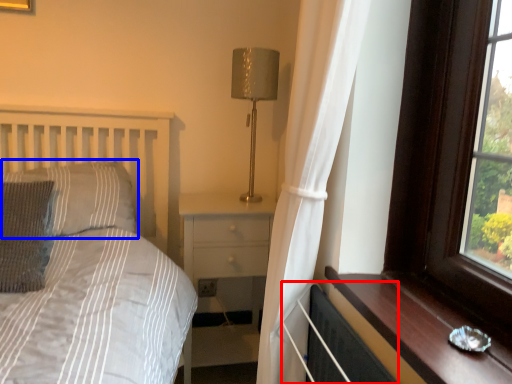
Question: Which of the following is the closest to the observer, radiator (highlighted by a red box) or pillow (highlighted by a blue box)?

Choices:
 (A) radiator
 (B) pillow

Answer: (A)